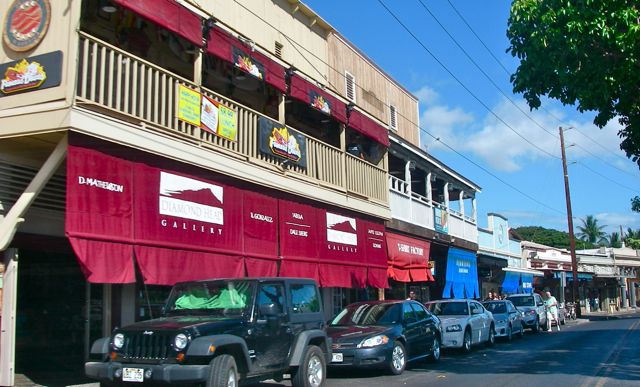
Locate an element on the screen. Image resolution: width=640 pixels, height=387 pixels. support beam is located at coordinates (24, 200).